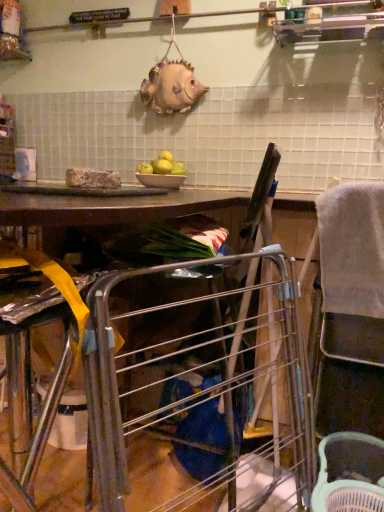
Where is `white glossy bowl at center`? white glossy bowl at center is located at coordinates (161, 180).

The image size is (384, 512). What do you see at coordinates (161, 180) in the screenshot?
I see `white glossy bowl at center` at bounding box center [161, 180].

Describe the element at coordinates (162, 166) in the screenshot. I see `green matte apples at center` at that location.

The width and height of the screenshot is (384, 512). Describe the element at coordinates (351, 310) in the screenshot. I see `gray fabric feeding chair at right` at that location.

At what (x,y) coordinates should I click in order to perform the action: click on gray fabric feeding chair at right. Please return your answer as a coordinate pair (x, y). This screenshot has width=384, height=512. Looking at the image, I should click on (351, 310).

The width and height of the screenshot is (384, 512). I want to click on white plastic basket at lower right, so click(x=349, y=474).

Considering the sizes of objects metallic silver workbench at center and green matte apples at center in the image provided, who is taller, metallic silver workbench at center or green matte apples at center?

With more height is metallic silver workbench at center.

From the picture: Do you think metallic silver workbench at center is within green matte apples at center, or outside of it?

metallic silver workbench at center exists outside the volume of green matte apples at center.

Identify the location of workbench lying in front of the green matte apples at center. (146, 382).

Considering the sizes of metallic silver workbench at center and green matte apples at center in the image, is metallic silver workbench at center bigger or smaller than green matte apples at center?

Clearly, metallic silver workbench at center is larger in size than green matte apples at center.

Considering the positions of point (166, 165) and point (172, 181), is point (166, 165) closer or farther from the camera than point (172, 181)?

Clearly, point (166, 165) is more distant from the camera than point (172, 181).

From the image's perspective, is green matte apples at center below white glossy bowl at center?

Incorrect, from the image's perspective, green matte apples at center is higher than white glossy bowl at center.

Is green matte apples at center to the left or to the right of white glossy bowl at center in the image?

In the image, green matte apples at center appears on the left side of white glossy bowl at center.

Is green matte apples at center surrounding white glossy bowl at center?

No, white glossy bowl at center is not surrounded by green matte apples at center.

How different are the orientations of white plastic basket at lower right and white glossy bowl at center in degrees?

The facing directions of white plastic basket at lower right and white glossy bowl at center are 0.000687 degrees apart.

Relative to white glossy bowl at center, is white plastic basket at lower right in front or behind?

Visually, white plastic basket at lower right is located in front of white glossy bowl at center.

Does point (333, 455) come closer to viewer compared to point (152, 178)?

That is True.

From a real-world perspective, does white plastic basket at lower right sit lower than white glossy bowl at center?

Indeed, from a real-world perspective, white plastic basket at lower right is positioned beneath white glossy bowl at center.

Which of these two, metallic silver workbench at center or white plastic basket at lower right, is smaller?

white plastic basket at lower right is smaller.

Based on the photo, considering the sizes of objects metallic silver workbench at center and white plastic basket at lower right in the image provided, who is shorter, metallic silver workbench at center or white plastic basket at lower right?

With less height is white plastic basket at lower right.

Does metallic silver workbench at center lie behind white plastic basket at lower right?

That is False.

Does white glossy bowl at center have a larger size compared to metallic silver workbench at center?

No, white glossy bowl at center is not bigger than metallic silver workbench at center.

Is white glossy bowl at center taller than metallic silver workbench at center?

In fact, white glossy bowl at center may be shorter than metallic silver workbench at center.

Between white glossy bowl at center and metallic silver workbench at center, which one is positioned behind?

white glossy bowl at center is further away from the camera.

Is point (155, 186) behind point (279, 387)?

Yes, point (155, 186) is behind point (279, 387).

Between point (176, 182) and point (318, 204), which one is positioned behind?

The point (176, 182) is farther from the camera.

Measure the distance between white glossy bowl at center and gray fabric feeding chair at right.

The distance of white glossy bowl at center from gray fabric feeding chair at right is 31.15 inches.

Relative to gray fabric feeding chair at right, is white glossy bowl at center in front or behind?

white glossy bowl at center is behind gray fabric feeding chair at right.

The height and width of the screenshot is (512, 384). I want to click on bowl located above the metallic silver workbench at center (from the image's perspective), so click(161, 180).

Is metallic silver workbench at center wider or thinner than white glossy bowl at center?

Clearly, metallic silver workbench at center has more width compared to white glossy bowl at center.

Between point (293, 440) and point (140, 182), which one is positioned behind?

The point (140, 182) is behind.

Locate an element on the screen. workbench on the left of green matte apples at center is located at coordinates (146, 382).

You are a GUI agent. You are given a task and a screenshot of the screen. Output one action in this format:
    pyautogui.click(x=<x>, y=<y>)
    Task: Click on the fruit in front of the white glossy bowl at center
    
    Given the screenshot: What is the action you would take?
    pyautogui.click(x=162, y=166)

Based on their spatial positions, is white plastic basket at lower right or green matte apples at center further from gray fabric feeding chair at right?

green matte apples at center is positioned further to the anchor gray fabric feeding chair at right.

Considering their positions, is green matte apples at center positioned further to gray fabric feeding chair at right than white plastic basket at lower right?

green matte apples at center.

From the picture: Which object lies nearer to the anchor point white plastic basket at lower right, white glossy bowl at center or green matte apples at center?

Based on the image, white glossy bowl at center appears to be nearer to white plastic basket at lower right.

Considering their positions, is green matte apples at center positioned further to white plastic basket at lower right than gray fabric feeding chair at right?

green matte apples at center is further to white plastic basket at lower right.

Considering their positions, is white glossy bowl at center positioned closer to metallic silver workbench at center than gray fabric feeding chair at right?

gray fabric feeding chair at right.

Considering their positions, is green matte apples at center positioned closer to gray fabric feeding chair at right than metallic silver workbench at center?

The object closer to gray fabric feeding chair at right is metallic silver workbench at center.

Estimate the real-world distances between objects in this image. Which object is closer to white glossy bowl at center, gray fabric feeding chair at right or white plastic basket at lower right?

The object closer to white glossy bowl at center is gray fabric feeding chair at right.

Which object lies further to the anchor point white glossy bowl at center, gray fabric feeding chair at right or green matte apples at center?

gray fabric feeding chair at right.

Where is `fruit between metallic silver workbench at center and white glossy bowl at center in the front-back direction`? fruit between metallic silver workbench at center and white glossy bowl at center in the front-back direction is located at coordinates (162, 166).

The image size is (384, 512). In order to click on bowl between green matte apples at center and white plastic basket at lower right from top to bottom in this screenshot , I will do pyautogui.click(x=161, y=180).

Locate an element on the screen. fruit positioned between gray fabric feeding chair at right and white glossy bowl at center from near to far is located at coordinates (162, 166).

I want to click on feeding chair between green matte apples at center and white plastic basket at lower right vertically, so click(x=351, y=310).